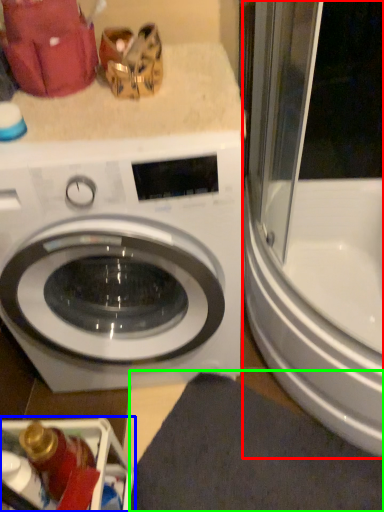
Question: Estimate the real-world distances between objects in this image. Which object is closer to screen door (highlighted by a red box), dish washer (highlighted by a blue box) or bath mat (highlighted by a green box)?

Choices:
 (A) dish washer
 (B) bath mat

Answer: (B)